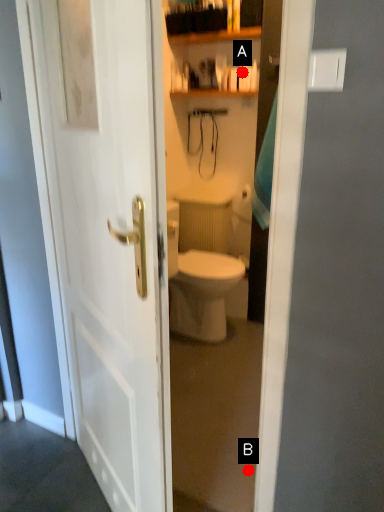
Question: Two points are circled on the image, labeled by A and B beside each circle. Which of the following is the closest to the observer?

Choices:
 (A) A is closer
 (B) B is closer

Answer: (B)